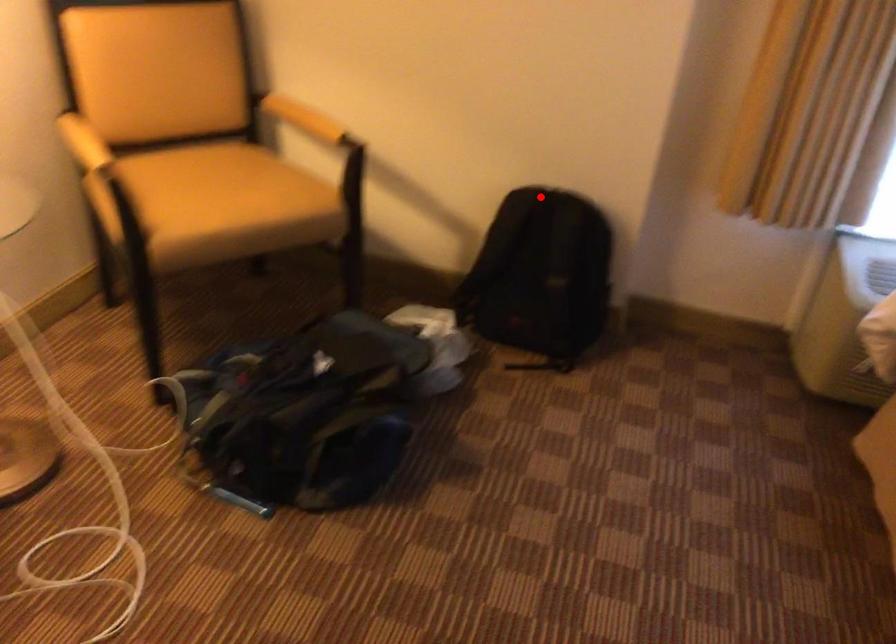
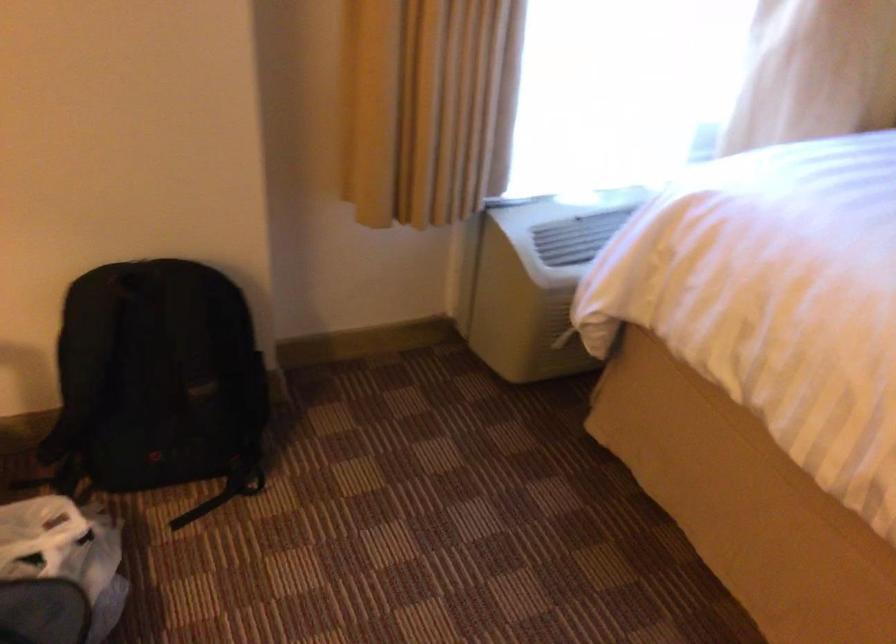
In the second image, find the point that corresponds to the highlighted location in the first image.

(135, 281)